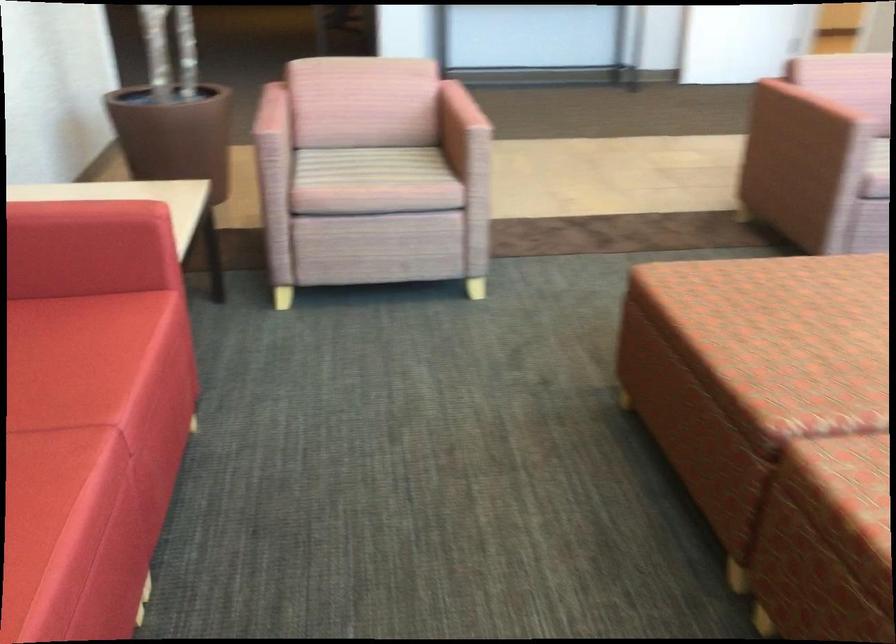
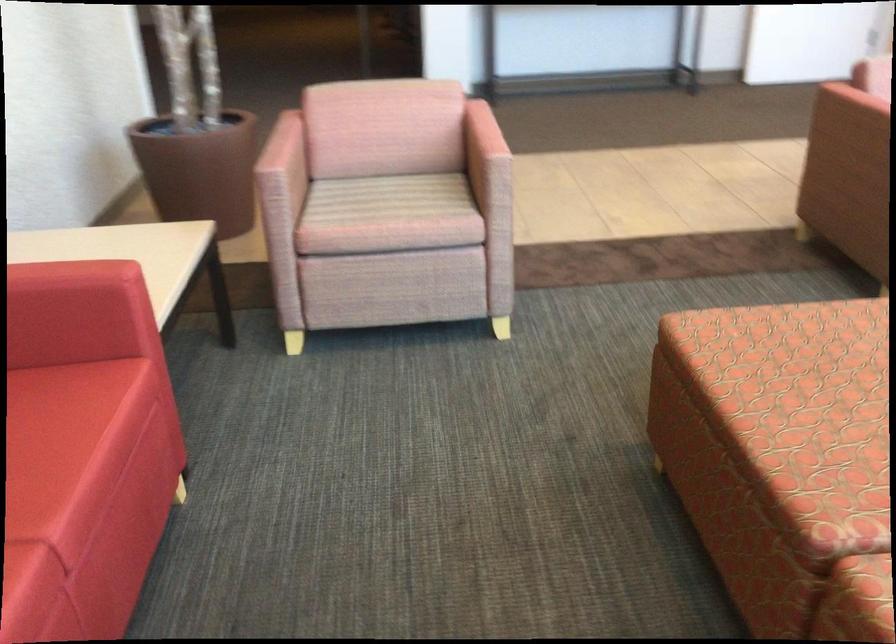
Where in the second image is the point corresponding to (x=462, y=106) from the first image?

(481, 133)